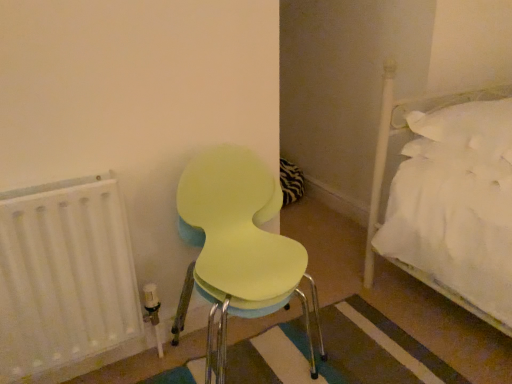
In order to face light yellow plastic chair at center-left, should I rotate leftwards or rightwards?

To face it directly, rotate left by 1.373 degrees.

The width and height of the screenshot is (512, 384). What do you see at coordinates (238, 247) in the screenshot?
I see `light yellow plastic chair at center-left` at bounding box center [238, 247].

The image size is (512, 384). What are the coordinates of `light yellow plastic chair at center-left` in the screenshot? It's located at (238, 247).

Measure the distance between white matte radiator at left and camera.

white matte radiator at left is 39.29 inches away from camera.

The height and width of the screenshot is (384, 512). Identify the location of white matte radiator at left. (64, 278).

Describe the element at coordinates (64, 278) in the screenshot. I see `white matte radiator at left` at that location.

Find the location of a particular element. Image resolution: width=512 pixels, height=384 pixels. light yellow plastic chair at center-left is located at coordinates 238,247.

Which object is positioned more to the right, light yellow plastic chair at center-left or white matte radiator at left?

light yellow plastic chair at center-left is more to the right.

Considering their positions, is light yellow plastic chair at center-left located in front of or behind white matte radiator at left?

In the image, light yellow plastic chair at center-left appears in front of white matte radiator at left.

Is point (217, 190) positioned behind point (115, 285)?

Yes, point (217, 190) is behind point (115, 285).

From the image's perspective, relative to white matte radiator at left, is light yellow plastic chair at center-left above or below?

light yellow plastic chair at center-left is above white matte radiator at left.

In the scene shown: From a real-world perspective, does light yellow plastic chair at center-left sit lower than white matte radiator at left?

No.

Considering the relative sizes of light yellow plastic chair at center-left and white matte radiator at left in the image provided, is light yellow plastic chair at center-left wider than white matte radiator at left?

Yes, light yellow plastic chair at center-left is wider than white matte radiator at left.

From their relative heights in the image, would you say light yellow plastic chair at center-left is taller or shorter than white matte radiator at left?

Clearly, light yellow plastic chair at center-left is taller compared to white matte radiator at left.

Who is bigger, light yellow plastic chair at center-left or white matte radiator at left?

With larger size is light yellow plastic chair at center-left.

Would you say light yellow plastic chair at center-left is inside or outside white matte radiator at left?

light yellow plastic chair at center-left is outside white matte radiator at left.

Are light yellow plastic chair at center-left and white matte radiator at left making contact?

No, light yellow plastic chair at center-left is not in contact with white matte radiator at left.

Is white matte radiator at left at the back of light yellow plastic chair at center-left?

No, light yellow plastic chair at center-left is not facing the opposite direction of white matte radiator at left.

Identify the location of chair located above the white matte radiator at left (from a real-world perspective). (238, 247).

Between white matte radiator at left and light yellow plastic chair at center-left, which one appears on the left side from the viewer's perspective?

white matte radiator at left is more to the left.

Is white matte radiator at left further to the viewer compared to light yellow plastic chair at center-left?

Yes, white matte radiator at left is further from the camera.

Does point (18, 317) appear closer or farther from the camera than point (231, 229)?

Point (18, 317) is positioned closer to the camera compared to point (231, 229).

From the image's perspective, which object appears higher, white matte radiator at left or light yellow plastic chair at center-left?

From the image's view, light yellow plastic chair at center-left is above.

From a real-world perspective, is white matte radiator at left located higher than light yellow plastic chair at center-left?

No.

In the scene shown: Looking at their sizes, would you say white matte radiator at left is wider or thinner than light yellow plastic chair at center-left?

white matte radiator at left is thinner than light yellow plastic chair at center-left.

From their relative heights in the image, would you say white matte radiator at left is taller or shorter than light yellow plastic chair at center-left?

Considering their sizes, white matte radiator at left has less height than light yellow plastic chair at center-left.

Considering the sizes of objects white matte radiator at left and light yellow plastic chair at center-left in the image provided, who is smaller, white matte radiator at left or light yellow plastic chair at center-left?

white matte radiator at left is smaller.

Is white matte radiator at left spatially inside light yellow plastic chair at center-left, or outside of it?

white matte radiator at left is spatially situated outside light yellow plastic chair at center-left.

Is white matte radiator at left not near light yellow plastic chair at center-left?

No, white matte radiator at left is in close proximity to light yellow plastic chair at center-left.

Could you tell me if white matte radiator at left is turned towards light yellow plastic chair at center-left?

No, white matte radiator at left does not turn towards light yellow plastic chair at center-left.

In the scene shown: What's the angular difference between white matte radiator at left and light yellow plastic chair at center-left's facing directions?

The angle between the facing direction of white matte radiator at left and the facing direction of light yellow plastic chair at center-left is 0.324 degrees.

In the image, there is a white matte radiator at left. Find the location of `chair above it (from the image's perspective)`. chair above it (from the image's perspective) is located at coordinates coord(238,247).

Locate an element on the screen. radiator behind the light yellow plastic chair at center-left is located at coordinates (64, 278).

The image size is (512, 384). In order to click on radiator that is on the left side of light yellow plastic chair at center-left in this screenshot , I will do `click(64, 278)`.